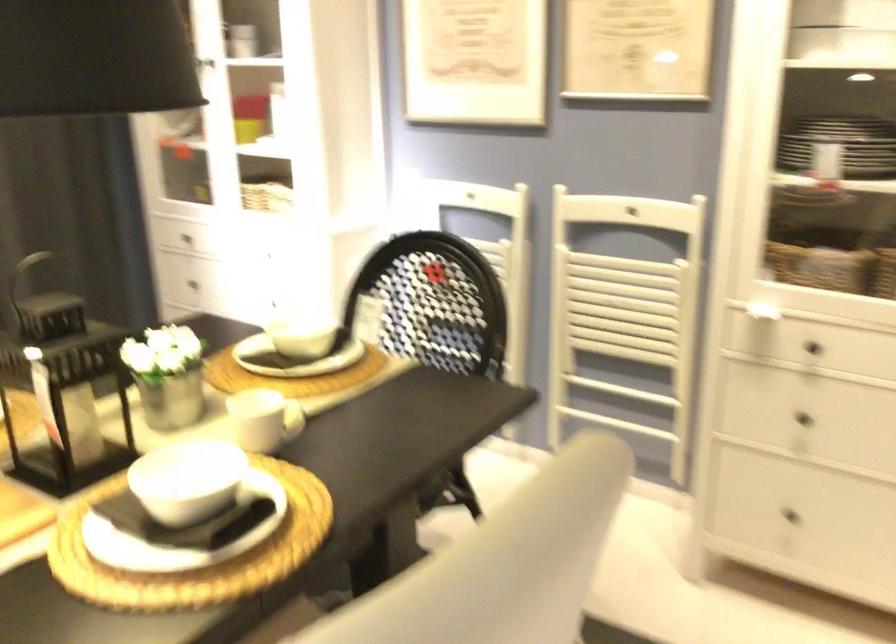
What do you see at coordinates (262, 420) in the screenshot? This screenshot has width=896, height=644. I see `the white coffee mug` at bounding box center [262, 420].